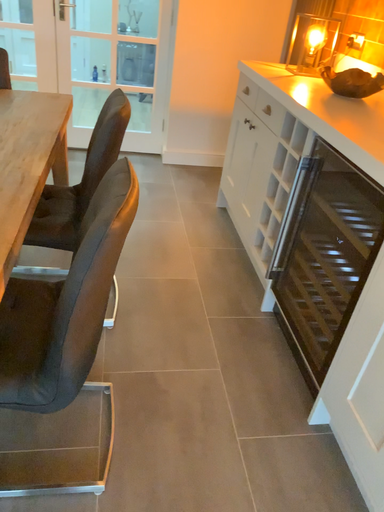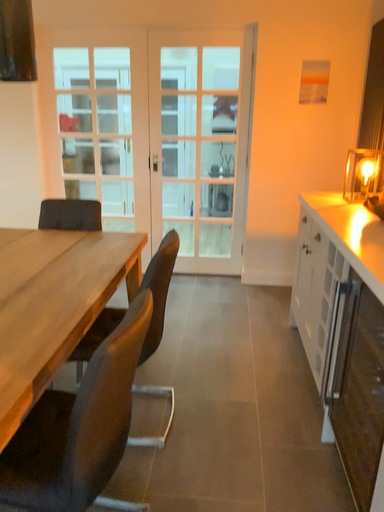
Question: How did the camera likely rotate when shooting the video?

Choices:
 (A) rotated downward
 (B) rotated upward

Answer: (B)